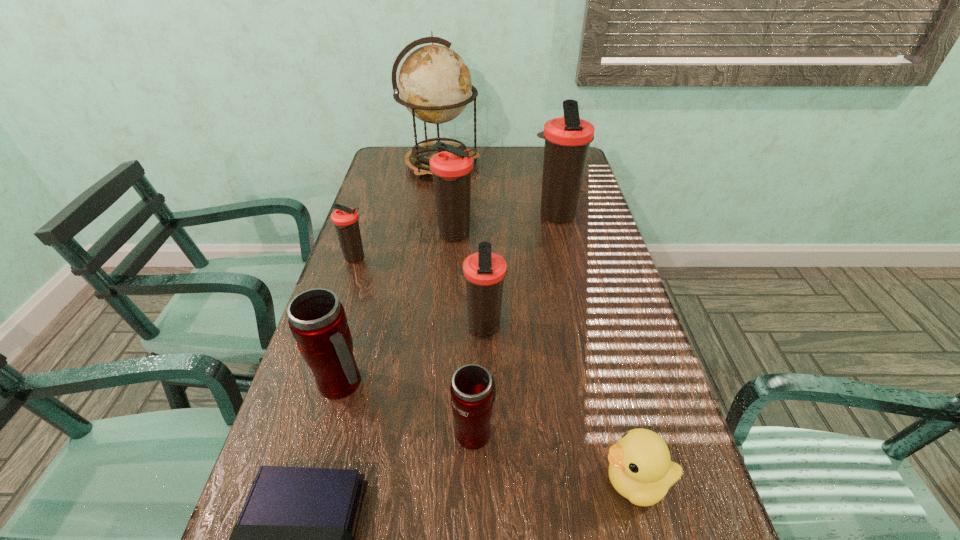
You are a GUI agent. You are given a task and a screenshot of the screen. Output one action in this format:
    pyautogui.click(x=<x>, y=<y>)
    Task: Click on the vacant region that satisfies the following two spatial constraints: 1. on the back side of the fifth shortest thermos bottle; 2. at the center of the tallest object
    The height and width of the screenshot is (540, 960).
    Given the screenshot: What is the action you would take?
    pyautogui.click(x=461, y=165)

Identify the location of blank area in the image that satisfies the following two spatial constraints: 1. on the back side of the tallest thermos bottle; 2. on the left side of the smallest brown thermos bottle. Image resolution: width=960 pixels, height=540 pixels. (370, 215).

Where is `vacant space that satisfies the following two spatial constraints: 1. on the side with the handle of the nearer red thermos bottle; 2. on the side with the handle of the left red thermos bottle`? The image size is (960, 540). vacant space that satisfies the following two spatial constraints: 1. on the side with the handle of the nearer red thermos bottle; 2. on the side with the handle of the left red thermos bottle is located at coordinates (475, 383).